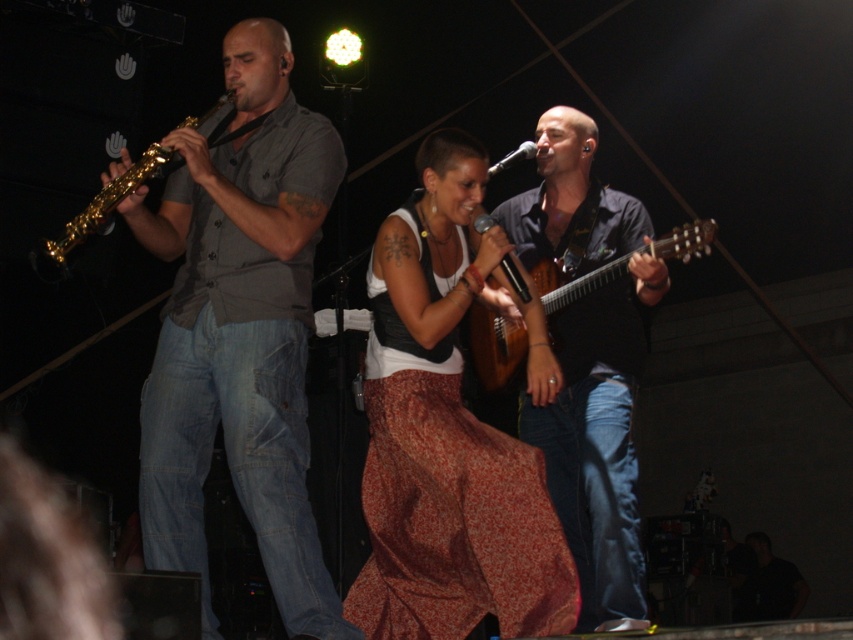
Question: Does matte gray shirt at center appear on the right side of dark blue shirt at center?

Choices:
 (A) no
 (B) yes

Answer: (A)

Question: Which of these objects is positioned farthest from the printed cotton skirt at center?

Choices:
 (A) wooden acoustic guitar at center
 (B) matte gray shirt at center

Answer: (B)

Question: Can you confirm if matte gray shirt at center is thinner than wooden acoustic guitar at center?

Choices:
 (A) no
 (B) yes

Answer: (A)

Question: Which point is closer to the camera?

Choices:
 (A) printed cotton skirt at center
 (B) dark blue shirt at center

Answer: (A)

Question: Which object is closer to the camera taking this photo?

Choices:
 (A) matte gray shirt at center
 (B) dark blue shirt at center
 (C) printed cotton skirt at center
 (D) gold shiny saxophone at left

Answer: (A)

Question: Can you confirm if matte gray shirt at center is positioned below dark blue shirt at center?

Choices:
 (A) no
 (B) yes

Answer: (A)